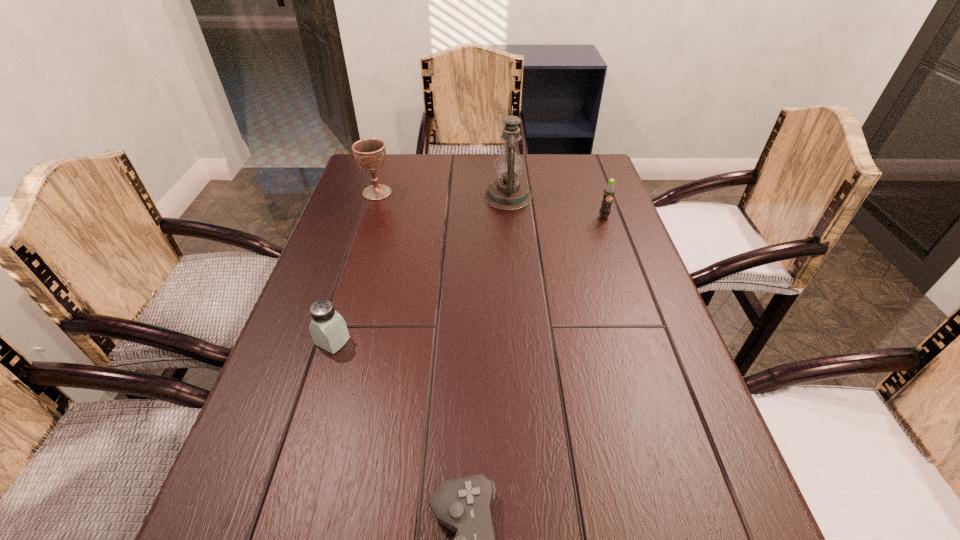
The height and width of the screenshot is (540, 960). Find the location of `vacant area that lies between the tallest object and the chalice`. vacant area that lies between the tallest object and the chalice is located at coordinates (443, 194).

What are the coordinates of `free space that is in between the fourth shortest object and the oil lamp` in the screenshot? It's located at (443, 194).

The height and width of the screenshot is (540, 960). In order to click on free area in between the second nearest object and the rightmost object in this screenshot , I will do `click(468, 279)`.

You are a GUI agent. You are given a task and a screenshot of the screen. Output one action in this format:
    pyautogui.click(x=<x>, y=<y>)
    Task: Click on the empty location between the second tallest object and the tallest object
    
    Given the screenshot: What is the action you would take?
    (443, 194)

Where is `free space between the oil lamp and the soda`? This screenshot has height=540, width=960. free space between the oil lamp and the soda is located at coordinates (556, 207).

You are a GUI agent. You are given a task and a screenshot of the screen. Output one action in this format:
    pyautogui.click(x=<x>, y=<y>)
    Task: Click on the free space between the rightmost object and the oil lamp
    
    Given the screenshot: What is the action you would take?
    pyautogui.click(x=556, y=207)

Identify the location of free spot between the chalice and the second nearest object. The image size is (960, 540). (355, 267).

At what (x,y) coordinates should I click in order to perform the action: click on object that is the fourth closest to the third farthest object. Please return your answer as a coordinate pair (x, y). Looking at the image, I should click on (462, 505).

Identify the location of the closest object to the saltshaker. (462, 505).